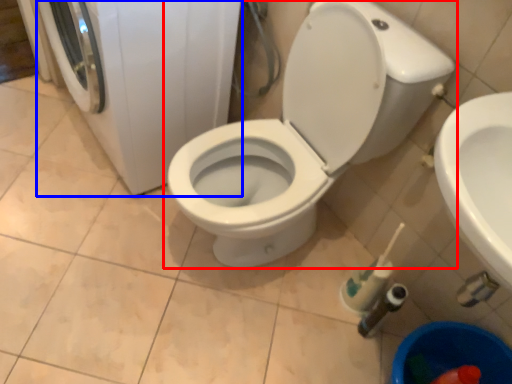
Question: Which point is further to the camera, toilet (highlighted by a red box) or washing machine (highlighted by a blue box)?

Choices:
 (A) toilet
 (B) washing machine

Answer: (B)